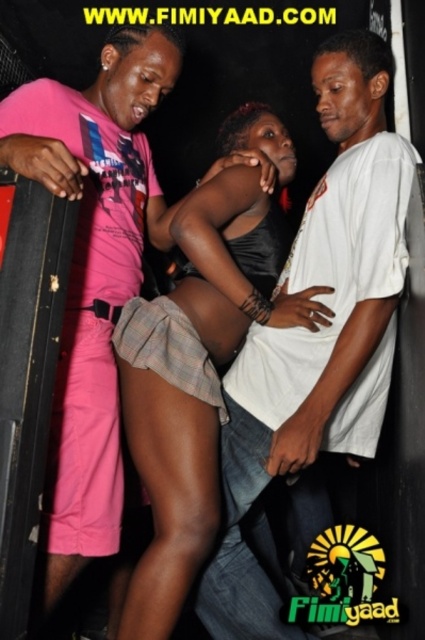
Question: Based on their relative distances, which object is farther from the black satin dress at center?

Choices:
 (A) white matte shirt at center
 (B) white cotton shirt at center

Answer: (B)

Question: Which of the following is the closest to the observer?

Choices:
 (A) white cotton shirt at center
 (B) black satin dress at center
 (C) white matte shirt at center

Answer: (A)

Question: Where is white matte shirt at center located in relation to black satin dress at center in the image?

Choices:
 (A) above
 (B) below

Answer: (B)

Question: Does white cotton shirt at center appear on the right side of black satin dress at center?

Choices:
 (A) no
 (B) yes

Answer: (A)

Question: Estimate the real-world distances between objects in this image. Which object is farther from the black satin dress at center?

Choices:
 (A) white matte shirt at center
 (B) white cotton shirt at center

Answer: (B)

Question: Is white cotton shirt at center to the left of black satin dress at center from the viewer's perspective?

Choices:
 (A) yes
 (B) no

Answer: (A)